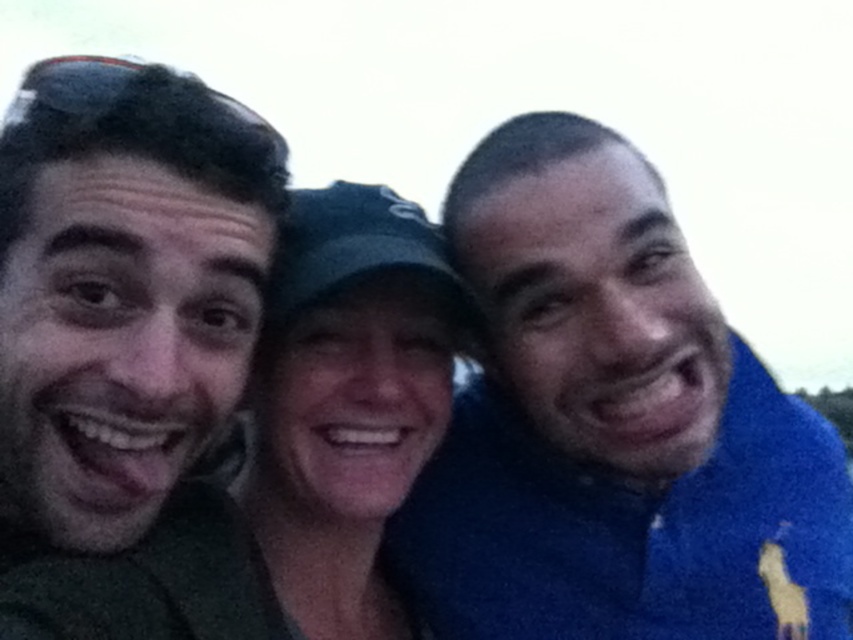
Question: Where is blue fleece jacket at right located in relation to matte green shirt at left in the image?

Choices:
 (A) above
 (B) below

Answer: (A)

Question: Which of the following is the farthest from the observer?

Choices:
 (A) (428, 536)
 (B) (300, 612)

Answer: (A)

Question: Can you confirm if blue fleece jacket at right is positioned to the right of matte green shirt at left?

Choices:
 (A) no
 (B) yes

Answer: (B)

Question: Which object is closer to the camera taking this photo?

Choices:
 (A) blue fleece jacket at right
 (B) matte green shirt at left

Answer: (B)

Question: Is blue fleece jacket at right wider than matte green shirt at left?

Choices:
 (A) yes
 (B) no

Answer: (A)